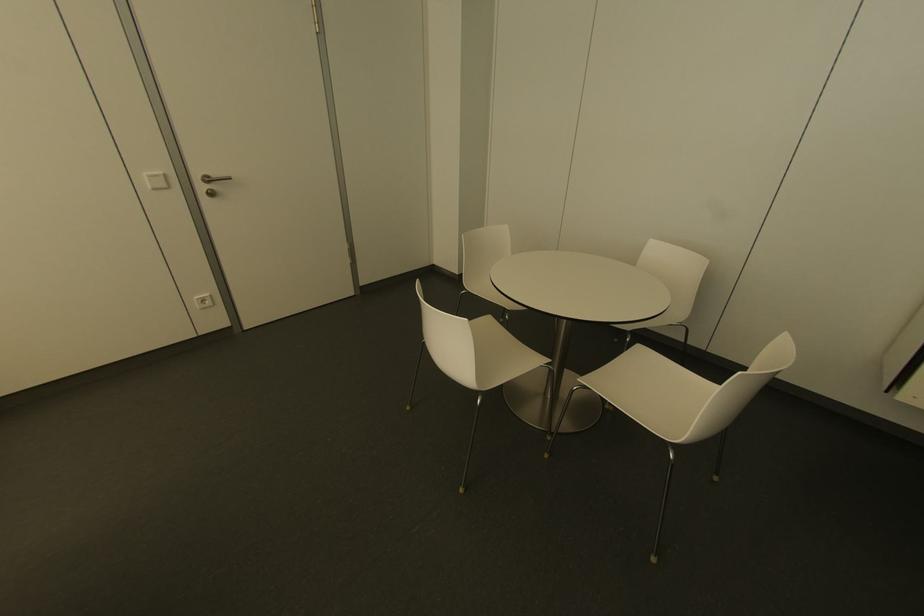
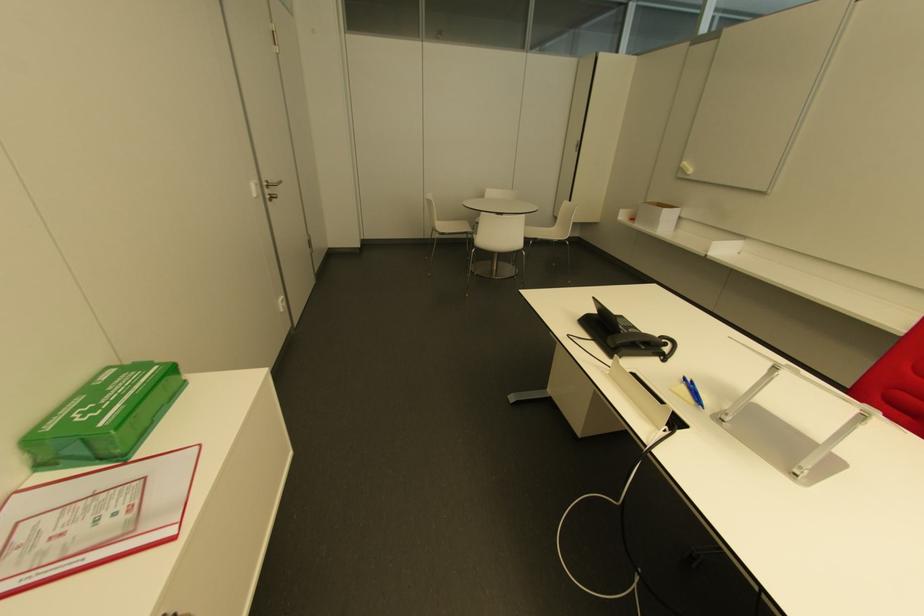
Find the pixel in the second image that matches point 228,179 in the first image.

(278, 182)